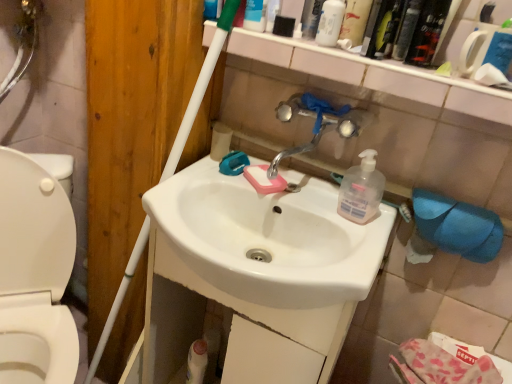
This screenshot has height=384, width=512. Find the location of `empty space that is ontop of metallic silver faucet at upper center (from a real-world perspective)`. empty space that is ontop of metallic silver faucet at upper center (from a real-world perspective) is located at coordinates (357, 54).